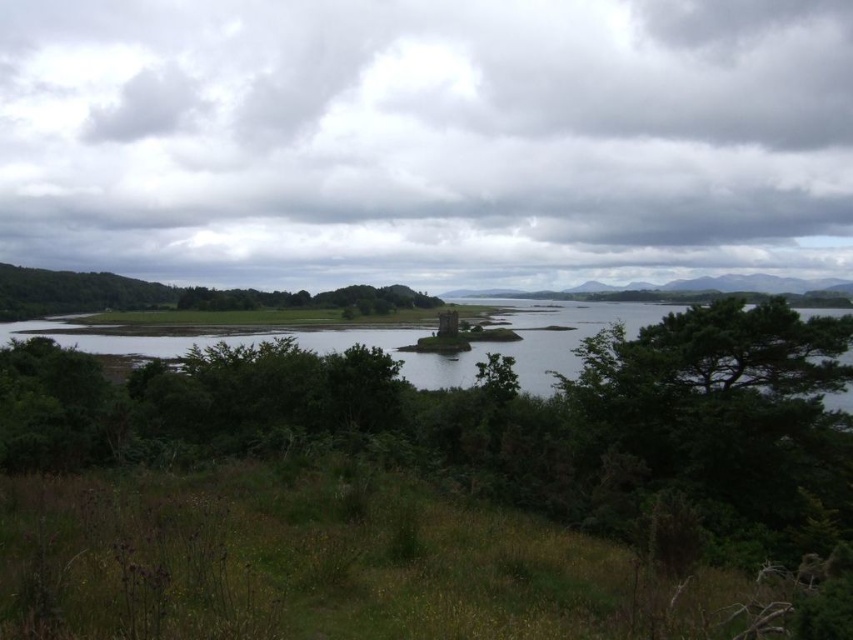
Question: Can you confirm if cloudy sky at upper center is smaller than green leafy tree at center?

Choices:
 (A) no
 (B) yes

Answer: (A)

Question: Is cloudy sky at upper center thinner than green grassy water at lower center?

Choices:
 (A) no
 (B) yes

Answer: (A)

Question: Considering the real-world distances, which object is farthest from the green grassy water at lower center?

Choices:
 (A) green leafy tree at center
 (B) cloudy sky at upper center

Answer: (B)

Question: Which of the following is the farthest from the observer?

Choices:
 (A) cloudy sky at upper center
 (B) green grassy water at lower center

Answer: (A)

Question: Which object is positioned closest to the green leafy tree at center?

Choices:
 (A) cloudy sky at upper center
 (B) green grassy water at lower center

Answer: (B)

Question: Does cloudy sky at upper center appear over green leafy tree at center?

Choices:
 (A) no
 (B) yes

Answer: (B)